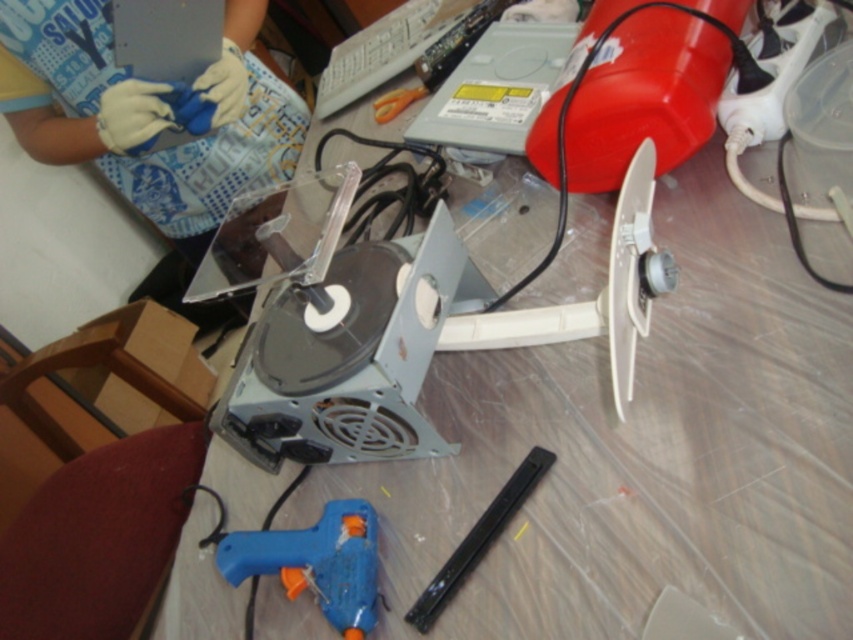
You are organizing the workspace and need to place a new tool between the blue plastic glue gun at lower center and the black plastic tool at lower center. Based on their positions, which object should you place the new tool closer to?

The new tool should be placed closer to the black plastic tool at lower center because the blue plastic glue gun at lower center is to the left of it, meaning there is more space on the right side between them.

You are an electronics technician working on a repair project. You need to access both the white plastic fan at center and the blue plastic glue gun at lower center. Which object is positioned to the right side of the other?

The white plastic fan at center is positioned to the right of the blue plastic glue gun at lower center.